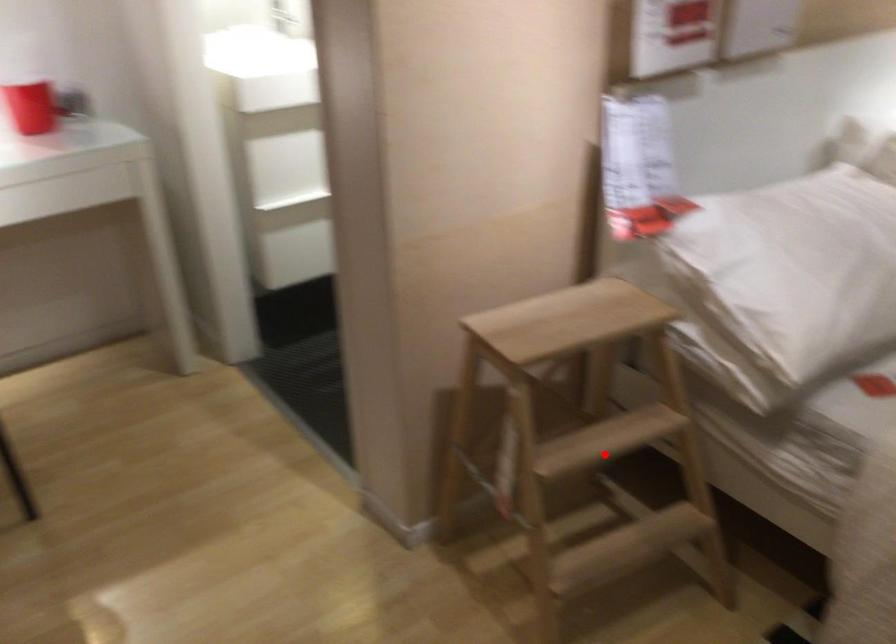
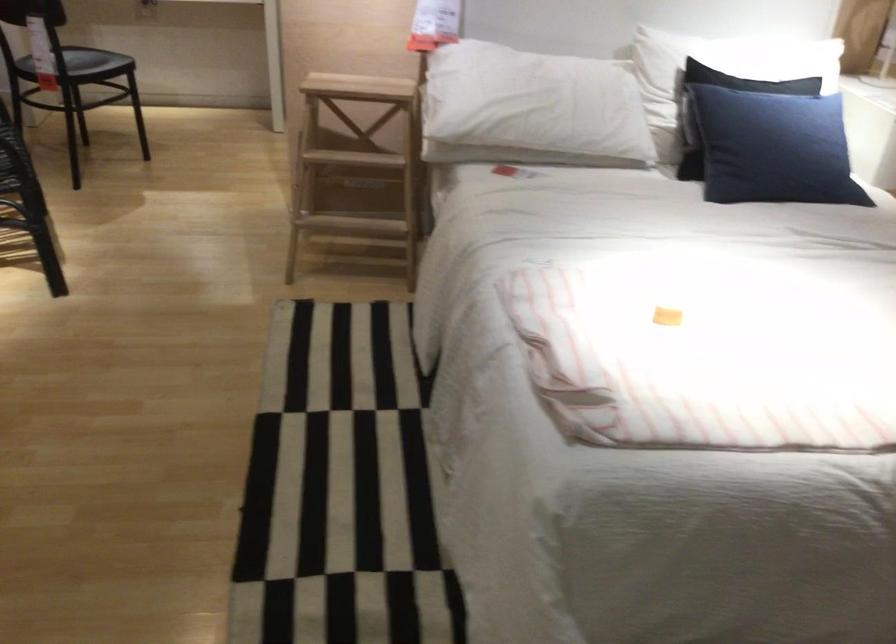
Question: I am providing you with two images of the same scene from different viewpoints. A red point is marked on the first image. Is the red point's position out of view in image 2?

Choices:
 (A) Yes
 (B) No

Answer: (B)